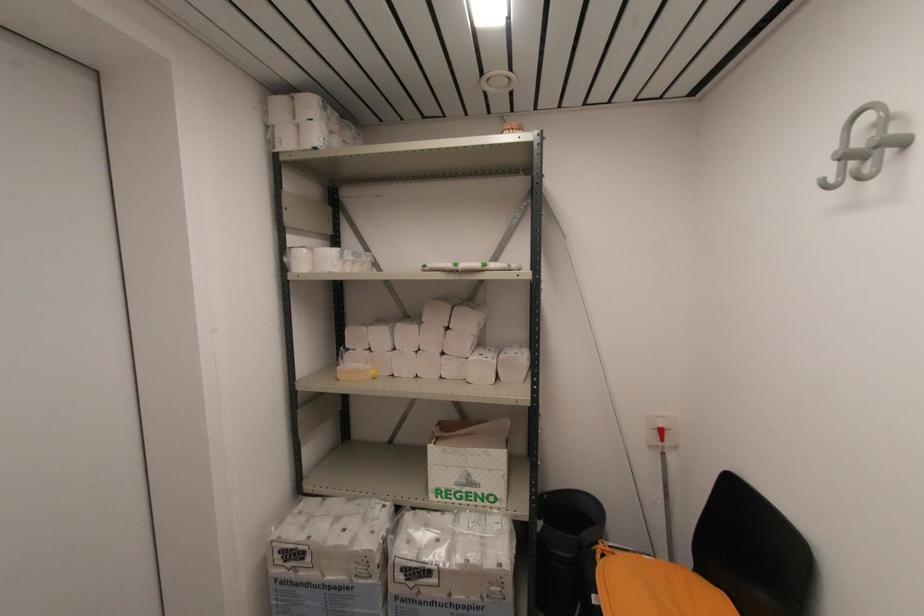
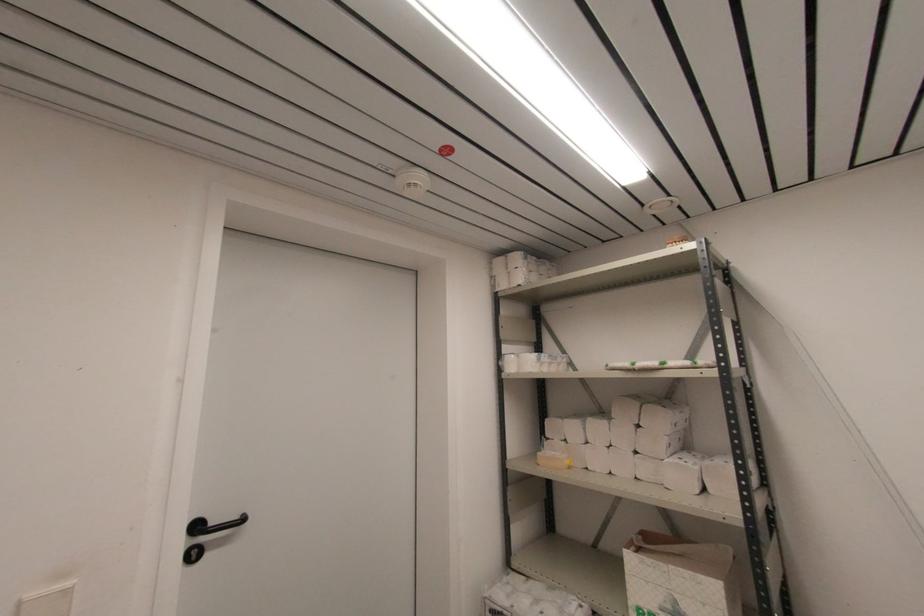
Based on the continuous images, in which direction is the camera rotating?

The camera rotated toward left-up.